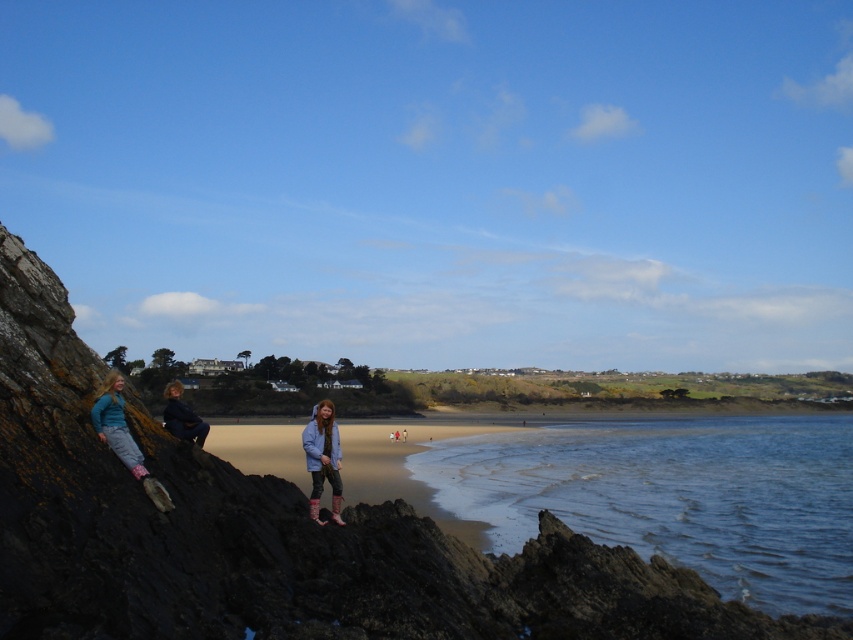
In the scene shown: You are a photographer standing at the shoreline. You want to take a photo that includes both the blue water at lower right and the matte black jacket at left. Given that your camera has a maximum zoom range of 100 meters, can you capture both subjects in a single frame without moving?

The blue water at lower right and the matte black jacket at left are 32.57 meters apart from each other. Since your camera has a maximum zoom range of 100 meters, which is greater than the distance between them, you can capture both subjects in a single frame without moving.

You are standing at the origin point of the coordinate system in the image. You want to walk to the blue water at lower right. What are the coordinates you need to reach?

The coordinates for the blue water at lower right are at point (675, 497).